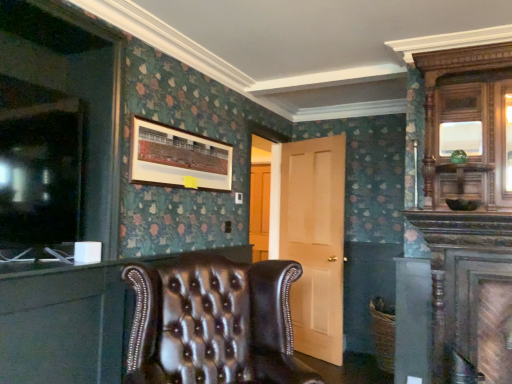
Question: Does light wood door at center appear on the right side of polished wood armoire at upper right?

Choices:
 (A) yes
 (B) no

Answer: (B)

Question: Is light wood door at center surrounding polished wood armoire at upper right?

Choices:
 (A) no
 (B) yes

Answer: (A)

Question: Does light wood door at center have a greater height compared to polished wood armoire at upper right?

Choices:
 (A) no
 (B) yes

Answer: (B)

Question: Does light wood door at center have a greater width compared to polished wood armoire at upper right?

Choices:
 (A) yes
 (B) no

Answer: (B)

Question: Can you confirm if light wood door at center is positioned to the left of polished wood armoire at upper right?

Choices:
 (A) yes
 (B) no

Answer: (A)

Question: Considering the relative sizes of light wood door at center and polished wood armoire at upper right in the image provided, is light wood door at center bigger than polished wood armoire at upper right?

Choices:
 (A) no
 (B) yes

Answer: (B)

Question: Is polished wood armoire at upper right at the back of leather tufted chair at lower left?

Choices:
 (A) yes
 (B) no

Answer: (B)

Question: Is there a large distance between leather tufted chair at lower left and polished wood armoire at upper right?

Choices:
 (A) no
 (B) yes

Answer: (B)

Question: From a real-world perspective, is leather tufted chair at lower left located beneath polished wood armoire at upper right?

Choices:
 (A) no
 (B) yes

Answer: (B)

Question: From the image's perspective, is leather tufted chair at lower left on top of polished wood armoire at upper right?

Choices:
 (A) yes
 (B) no

Answer: (B)

Question: Is leather tufted chair at lower left smaller than polished wood armoire at upper right?

Choices:
 (A) no
 (B) yes

Answer: (B)

Question: Does leather tufted chair at lower left have a larger size compared to polished wood armoire at upper right?

Choices:
 (A) yes
 (B) no

Answer: (B)

Question: Does leather tufted chair at lower left turn towards leather tufted chair at center?

Choices:
 (A) no
 (B) yes

Answer: (B)